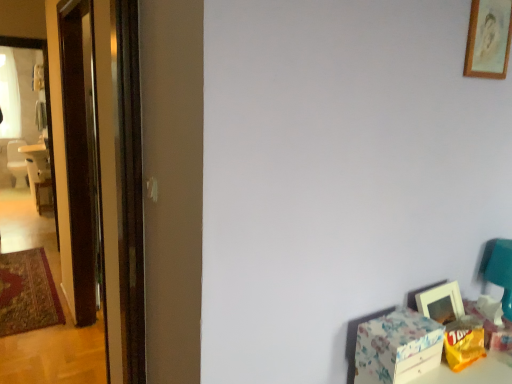
Question: Can you confirm if matte white picture frame at lower right, which ranks as the first picture frame in bottom-to-top order, is thinner than wooden frame at upper right, the first picture frame from the top?

Choices:
 (A) no
 (B) yes

Answer: (A)

Question: Is matte white picture frame at lower right, the 2th picture frame in the top-to-bottom sequence, closer to the viewer compared to wooden frame at upper right, the first picture frame from the top?

Choices:
 (A) no
 (B) yes

Answer: (A)

Question: Can you confirm if matte white picture frame at lower right, which ranks as the first picture frame in bottom-to-top order, is positioned to the right of wooden frame at upper right, marked as the second picture frame in a bottom-to-top arrangement?

Choices:
 (A) yes
 (B) no

Answer: (B)

Question: Are matte white picture frame at lower right, which ranks as the first picture frame in bottom-to-top order, and wooden frame at upper right, the first picture frame from the top, beside each other?

Choices:
 (A) no
 (B) yes

Answer: (A)

Question: Is matte white picture frame at lower right, the 2th picture frame in the top-to-bottom sequence, facing towards wooden frame at upper right, marked as the second picture frame in a bottom-to-top arrangement?

Choices:
 (A) yes
 (B) no

Answer: (B)

Question: From a real-world perspective, is matte white picture frame at lower right, the 2th picture frame in the top-to-bottom sequence, under wooden frame at upper right, the first picture frame from the top?

Choices:
 (A) no
 (B) yes

Answer: (B)

Question: Is wooden frame at upper right, marked as the second picture frame in a bottom-to-top arrangement, at the right side of matte white picture frame at lower right, the 2th picture frame in the top-to-bottom sequence?

Choices:
 (A) no
 (B) yes

Answer: (B)

Question: Would you say wooden frame at upper right, the first picture frame from the top, is outside matte white picture frame at lower right, the 2th picture frame in the top-to-bottom sequence?

Choices:
 (A) no
 (B) yes

Answer: (B)

Question: Is wooden frame at upper right, the first picture frame from the top, positioned before matte white picture frame at lower right, the 2th picture frame in the top-to-bottom sequence?

Choices:
 (A) no
 (B) yes

Answer: (B)

Question: Is wooden frame at upper right, marked as the second picture frame in a bottom-to-top arrangement, facing away from matte white picture frame at lower right, which ranks as the first picture frame in bottom-to-top order?

Choices:
 (A) yes
 (B) no

Answer: (B)

Question: Considering the relative sizes of wooden frame at upper right, the first picture frame from the top, and matte white picture frame at lower right, the 2th picture frame in the top-to-bottom sequence, in the image provided, is wooden frame at upper right, the first picture frame from the top, smaller than matte white picture frame at lower right, the 2th picture frame in the top-to-bottom sequence,?

Choices:
 (A) yes
 (B) no

Answer: (A)

Question: Can matte white picture frame at lower right, the 2th picture frame in the top-to-bottom sequence, be found inside wooden frame at upper right, the first picture frame from the top?

Choices:
 (A) no
 (B) yes

Answer: (A)

Question: Is matte white picture frame at lower right, the 2th picture frame in the top-to-bottom sequence, to the right of transparent glass screen door at left from the viewer's perspective?

Choices:
 (A) yes
 (B) no

Answer: (A)